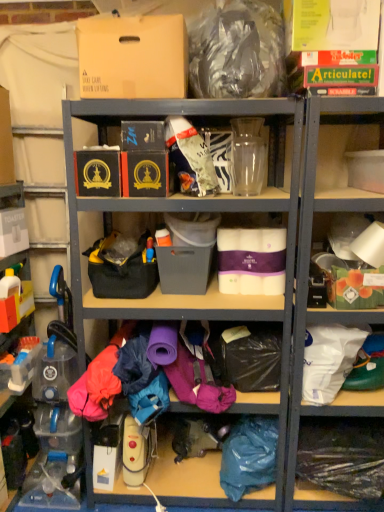
The height and width of the screenshot is (512, 384). Find the location of `clear plastic bottles at left, acting as the fifth shelf starting from the right`. clear plastic bottles at left, acting as the fifth shelf starting from the right is located at coordinates (19, 300).

This screenshot has height=512, width=384. In order to click on matte cardboard box at upper left, which appears as the third storage box when viewed from the left in this screenshot , I will do `click(133, 57)`.

What do you see at coordinates (187, 252) in the screenshot? I see `matte plastic storage box at center, the third storage box in the right-to-left sequence` at bounding box center [187, 252].

Measure the distance between point (169, 216) and camera.

Point (169, 216) is 6.32 feet from camera.

The image size is (384, 512). In order to click on white matte tissue box at center, the sixth storage box in the left-to-right sequence in this screenshot , I will do 251,260.

In terms of height, does matte plastic storage box at center, the third storage box in the right-to-left sequence, look taller or shorter compared to white matte tissue box at center, the second storage box from the right?

In the image, matte plastic storage box at center, the third storage box in the right-to-left sequence, appears to be shorter than white matte tissue box at center, the second storage box from the right.

Between point (198, 253) and point (284, 275), which one is positioned in front?

Point (284, 275)

Which object is more forward, matte plastic storage box at center, the third storage box in the right-to-left sequence, or white matte tissue box at center, the sixth storage box in the left-to-right sequence?

Positioned in front is white matte tissue box at center, the sixth storage box in the left-to-right sequence.

What's the angular difference between matte plastic storage box at center, the third storage box in the right-to-left sequence, and white matte tissue box at center, the second storage box from the right,'s facing directions?

0.225 degrees separate the facing orientations of matte plastic storage box at center, the third storage box in the right-to-left sequence, and white matte tissue box at center, the second storage box from the right.

Does clear plastic bag at lower right, placed as the third shelf when sorted from right to left, appear on the left side of matte cardboard box at upper left, which appears as the third storage box when viewed from the left?

No, clear plastic bag at lower right, placed as the third shelf when sorted from right to left, is not to the left of matte cardboard box at upper left, which appears as the third storage box when viewed from the left.

Which is closer, (350, 486) or (135, 83)?

The point (135, 83) is closer to the camera.

Is clear plastic bag at lower right, the third shelf positioned from the left, wider than matte cardboard box at upper left, the 5th storage box viewed from the right?

Indeed, clear plastic bag at lower right, the third shelf positioned from the left, has a greater width compared to matte cardboard box at upper left, the 5th storage box viewed from the right.

This screenshot has height=512, width=384. I want to click on the 1st shelf counting from the right of the matte cardboard box at upper left, which appears as the third storage box when viewed from the left, so click(342, 455).

The height and width of the screenshot is (512, 384). What are the coordinates of `storage box that is the 2nd object to the right of the white plastic toaster at left, the seventh storage box from the right, starting at the anchor` in the screenshot? It's located at (133, 57).

From the image's perspective, is matte cardboard box at upper left, which appears as the third storage box when viewed from the left, over white plastic toaster at left, the seventh storage box from the right?

Yes, from the image's perspective, matte cardboard box at upper left, which appears as the third storage box when viewed from the left, is over white plastic toaster at left, the seventh storage box from the right.

Is white plastic toaster at left, the seventh storage box from the right, completely or partially inside matte cardboard box at upper left, the 5th storage box viewed from the right?

No, white plastic toaster at left, the seventh storage box from the right, is not surrounded by matte cardboard box at upper left, the 5th storage box viewed from the right.

Which object is closer to the camera, matte cardboard box at upper left, the 5th storage box viewed from the right, or white plastic toaster at left, the seventh storage box from the right?

matte cardboard box at upper left, the 5th storage box viewed from the right, is more forward.

Does clear plastic bag at lower right, the third shelf positioned from the left, lie behind blue fabric at lower right?

That is False.

Considering the relative sizes of clear plastic bag at lower right, placed as the third shelf when sorted from right to left, and blue fabric at lower right in the image provided, is clear plastic bag at lower right, placed as the third shelf when sorted from right to left, smaller than blue fabric at lower right?

Actually, clear plastic bag at lower right, placed as the third shelf when sorted from right to left, might be larger than blue fabric at lower right.

Looking at this image, considering the relative positions of clear plastic bag at lower right, placed as the third shelf when sorted from right to left, and blue fabric at lower right in the image provided, is clear plastic bag at lower right, placed as the third shelf when sorted from right to left, to the right of blue fabric at lower right from the viewer's perspective?

Correct, you'll find clear plastic bag at lower right, placed as the third shelf when sorted from right to left, to the right of blue fabric at lower right.

Which object is wider, clear plastic bag at lower right, placed as the third shelf when sorted from right to left, or blue fabric at lower right?

clear plastic bag at lower right, placed as the third shelf when sorted from right to left, is wider.

Considering the positions of point (350, 271) and point (247, 438), is point (350, 271) closer or farther from the camera than point (247, 438)?

Clearly, point (350, 271) is closer to the camera than point (247, 438).

Can you see white paper towel at right, arranged as the fourth shelf when viewed from the left, touching blue fabric at lower right?

No, white paper towel at right, arranged as the fourth shelf when viewed from the left, is not touching blue fabric at lower right.

From the picture: Is white paper towel at right, the second shelf when ordered from right to left, facing towards blue fabric at lower right?

No.

Based on the photo, considering the relative sizes of white paper towel at right, the second shelf when ordered from right to left, and blue fabric at lower right in the image provided, is white paper towel at right, the second shelf when ordered from right to left, wider than blue fabric at lower right?

In fact, white paper towel at right, the second shelf when ordered from right to left, might be narrower than blue fabric at lower right.

From the picture: Is clear plastic bag at lower right, placed as the third shelf when sorted from right to left, wider or thinner than white matte lampshade at upper right, which ranks as the first shelf in right-to-left order?

In the image, clear plastic bag at lower right, placed as the third shelf when sorted from right to left, appears to be more narrow than white matte lampshade at upper right, which ranks as the first shelf in right-to-left order.

Which object is positioned more to the left, clear plastic bag at lower right, placed as the third shelf when sorted from right to left, or white matte lampshade at upper right, which ranks as the first shelf in right-to-left order?

Positioned to the left is clear plastic bag at lower right, placed as the third shelf when sorted from right to left.

Considering the points (311, 447) and (296, 352), which point is in front, point (311, 447) or point (296, 352)?

The point (296, 352) is in front.

From a real-world perspective, between clear plastic bag at lower right, the third shelf positioned from the left, and white matte lampshade at upper right, which is counted as the 5th shelf, starting from the left, who is vertically lower?

clear plastic bag at lower right, the third shelf positioned from the left, is physically lower.

Considering the sizes of white matte tissue box at center, the second storage box from the right, and clear plastic bottles at left, which is counted as the 1th shelf, starting from the left, in the image, is white matte tissue box at center, the second storage box from the right, bigger or smaller than clear plastic bottles at left, which is counted as the 1th shelf, starting from the left,?

In the image, white matte tissue box at center, the second storage box from the right, appears to be smaller than clear plastic bottles at left, which is counted as the 1th shelf, starting from the left.

Between white matte tissue box at center, the sixth storage box in the left-to-right sequence, and clear plastic bottles at left, which is counted as the 1th shelf, starting from the left, which one has less height?

white matte tissue box at center, the sixth storage box in the left-to-right sequence.

Based on the photo, is white matte tissue box at center, the sixth storage box in the left-to-right sequence, turned away from clear plastic bottles at left, which is counted as the 1th shelf, starting from the left?

No, clear plastic bottles at left, which is counted as the 1th shelf, starting from the left, is not at the back of white matte tissue box at center, the sixth storage box in the left-to-right sequence.

Can you tell me how much white matte tissue box at center, the sixth storage box in the left-to-right sequence, and clear plastic bottles at left, acting as the fifth shelf starting from the right, differ in facing direction?

white matte tissue box at center, the sixth storage box in the left-to-right sequence, and clear plastic bottles at left, acting as the fifth shelf starting from the right, are facing 89 degrees away from each other.

From a real-world perspective, starting from the matte plastic storage box at center, the third storage box in the right-to-left sequence, which storage box is the 1st one vertically above it? Please provide its 2D coordinates.

[(251, 260)]

The width and height of the screenshot is (384, 512). In order to click on the 5th shelf below the matte cardboard box at upper left, which appears as the third storage box when viewed from the left (from the image's perspective) in this screenshot , I will do `click(342, 455)`.

From the image, which object appears to be farther from matte black box at upper center, which is the second storage box from left to right, green cardboard storage box at right, positioned as the 7th storage box in left-to-right order, or white matte lampshade at upper right, which is counted as the 5th shelf, starting from the left?

green cardboard storage box at right, positioned as the 7th storage box in left-to-right order, lies further to matte black box at upper center, which is the second storage box from left to right, than the other object.

In the scene shown: Considering their positions, is clear plastic bottles at left, which is counted as the 1th shelf, starting from the left, positioned closer to clear plastic bottle at lower left, the 2th shelf from the left, than clear plastic bag at lower right, placed as the third shelf when sorted from right to left?

clear plastic bottles at left, which is counted as the 1th shelf, starting from the left, is positioned closer to the anchor clear plastic bottle at lower left, the 2th shelf from the left.

Which object lies nearer to the anchor point clear plastic bag at lower right, placed as the third shelf when sorted from right to left, white plastic toaster at left, the seventh storage box from the right, or white paper towel at right, arranged as the fourth shelf when viewed from the left?

white paper towel at right, arranged as the fourth shelf when viewed from the left, lies closer to clear plastic bag at lower right, placed as the third shelf when sorted from right to left, than the other object.

Which object lies nearer to the anchor point white plastic toaster at left, the seventh storage box from the right, matte black box at center, the fourth storage box when ordered from left to right, or matte black box at upper center, placed as the 6th storage box when sorted from right to left?

matte black box at upper center, placed as the 6th storage box when sorted from right to left, is closer to white plastic toaster at left, the seventh storage box from the right.

From the picture: Estimate the real-world distances between objects in this image. Which object is further from matte black box at center, which is the 4th storage box from right to left, white matte lampshade at upper right, which ranks as the first shelf in right-to-left order, or matte black box at upper center, placed as the 6th storage box when sorted from right to left?

Among the two, white matte lampshade at upper right, which ranks as the first shelf in right-to-left order, is located further to matte black box at center, which is the 4th storage box from right to left.

Looking at this image, from the image, which object appears to be nearer to clear plastic bag at lower right, placed as the third shelf when sorted from right to left, matte cardboard box at upper left, the 5th storage box viewed from the right, or white matte lampshade at upper right, which is counted as the 5th shelf, starting from the left?

white matte lampshade at upper right, which is counted as the 5th shelf, starting from the left, is closer to clear plastic bag at lower right, placed as the third shelf when sorted from right to left.

Looking at this image, based on their spatial positions, is matte black box at center, the fourth storage box when ordered from left to right, or white matte lampshade at upper right, which is counted as the 5th shelf, starting from the left, closer to clear plastic bottles at left, acting as the fifth shelf starting from the right?

matte black box at center, the fourth storage box when ordered from left to right, is closer to clear plastic bottles at left, acting as the fifth shelf starting from the right.

Based on their spatial positions, is clear plastic bag at lower right, the third shelf positioned from the left, or matte black box at center, the fourth storage box when ordered from left to right, closer to white paper towel at right, the second shelf when ordered from right to left?

Among the two, clear plastic bag at lower right, the third shelf positioned from the left, is located nearer to white paper towel at right, the second shelf when ordered from right to left.

Find the location of a particular element. The width and height of the screenshot is (384, 512). clothing between clear plastic bottle at lower left, the 2th shelf from the left, and clear plastic bag at lower right, the third shelf positioned from the left, from left to right is located at coordinates (249, 456).

Find the location of a particular element. The width and height of the screenshot is (384, 512). storage box between white matte tissue box at center, the second storage box from the right, and white matte lampshade at upper right, which is counted as the 5th shelf, starting from the left is located at coordinates (356, 288).

This screenshot has width=384, height=512. Identify the location of clothing that lies between white matte tissue box at center, the sixth storage box in the left-to-right sequence, and clear plastic bag at lower right, placed as the third shelf when sorted from right to left, from top to bottom. (249, 456).

At what (x,y) coordinates should I click in order to perform the action: click on clothing between clear plastic bottle at lower left, the fourth shelf in the right-to-left sequence, and white paper towel at right, the second shelf when ordered from right to left. Please return your answer as a coordinate pair (x, y). The width and height of the screenshot is (384, 512). Looking at the image, I should click on (249, 456).